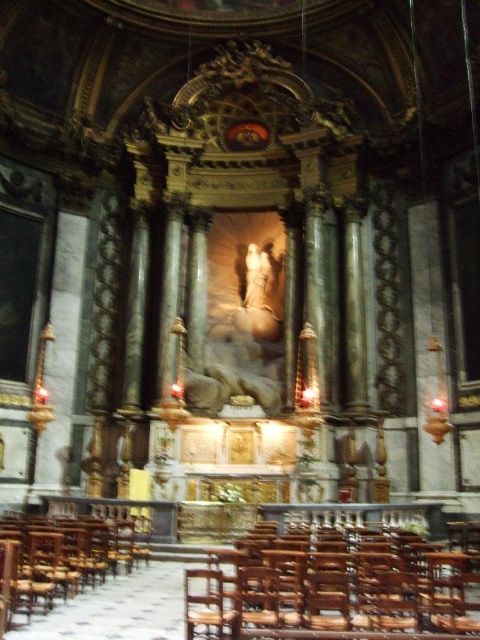
Does wooden polished chair at lower center have a greater height compared to wooden chair at left?

No, wooden polished chair at lower center is not taller than wooden chair at left.

Is point (232, 593) less distant than point (28, 524)?

Yes, point (232, 593) is closer to viewer.

Identify the location of wooden polished chair at lower center. The image size is (480, 640). click(x=334, y=586).